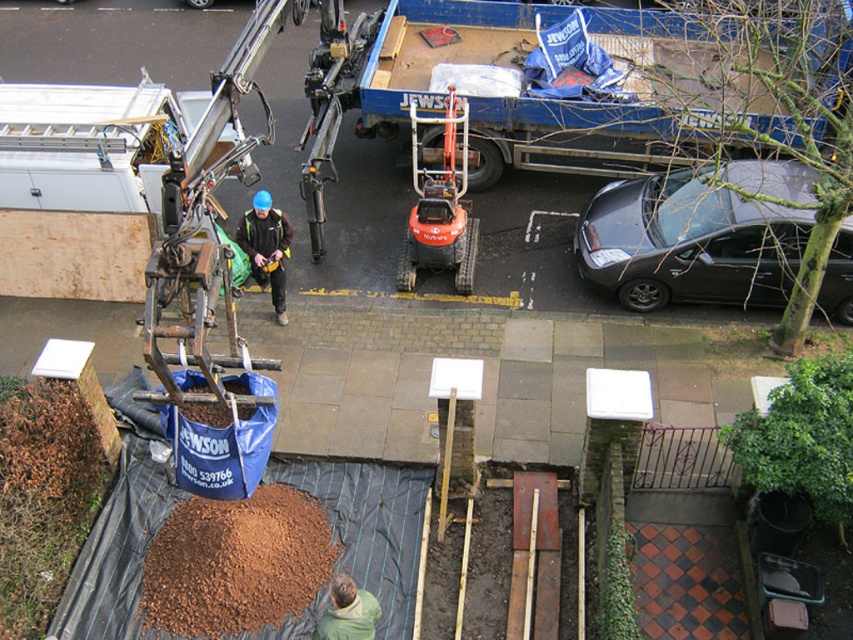
Question: Does shiny black car at right have a lesser width compared to black fabric tool belt at center?

Choices:
 (A) no
 (B) yes

Answer: (A)

Question: Is shiny black car at right smaller than black fabric tool belt at center?

Choices:
 (A) no
 (B) yes

Answer: (A)

Question: Among these points, which one is farthest from the camera?

Choices:
 (A) (486, 61)
 (B) (167, 518)
 (C) (212, 362)

Answer: (A)

Question: Which point is closer to the camera?

Choices:
 (A) brown mulch at lower center
 (B) orange rubberized compact tractor at center
 (C) rusty metal crane arm at center-left

Answer: (A)

Question: Which point appears farthest from the camera in this image?

Choices:
 (A) (143, 592)
 (B) (653, 284)

Answer: (B)

Question: Considering the relative positions of shiny black car at right and orange rubberized compact tractor at center in the image provided, where is shiny black car at right located with respect to orange rubberized compact tractor at center?

Choices:
 (A) below
 (B) above

Answer: (A)